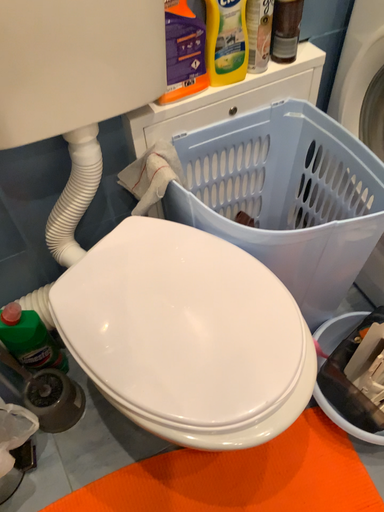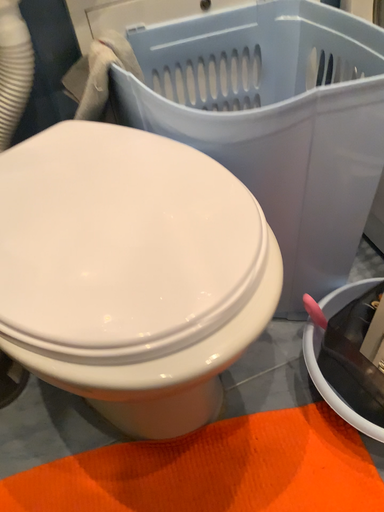
Question: How did the camera likely rotate when shooting the video?

Choices:
 (A) rotated upward
 (B) rotated downward

Answer: (A)